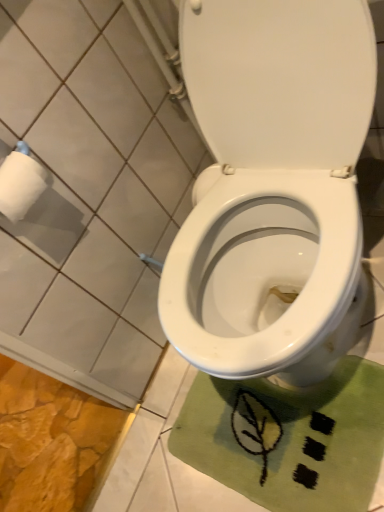
Question: Considering the positions of white matte toilet paper at upper left and green fabric bath mat at lower right in the image, is white matte toilet paper at upper left taller or shorter than green fabric bath mat at lower right?

Choices:
 (A) tall
 (B) short

Answer: (A)

Question: From the image's perspective, is white matte toilet paper at upper left positioned above or below green fabric bath mat at lower right?

Choices:
 (A) above
 (B) below

Answer: (A)

Question: From a real-world perspective, is white matte toilet paper at upper left above or below green fabric bath mat at lower right?

Choices:
 (A) below
 (B) above

Answer: (B)

Question: Is green fabric bath mat at lower right wider or thinner than white matte toilet paper at upper left?

Choices:
 (A) wide
 (B) thin

Answer: (A)

Question: In terms of size, does green fabric bath mat at lower right appear bigger or smaller than white matte toilet paper at upper left?

Choices:
 (A) big
 (B) small

Answer: (A)

Question: From the image's perspective, relative to white matte toilet paper at upper left, is green fabric bath mat at lower right above or below?

Choices:
 (A) above
 (B) below

Answer: (B)

Question: From their relative heights in the image, would you say green fabric bath mat at lower right is taller or shorter than white matte toilet paper at upper left?

Choices:
 (A) tall
 (B) short

Answer: (B)